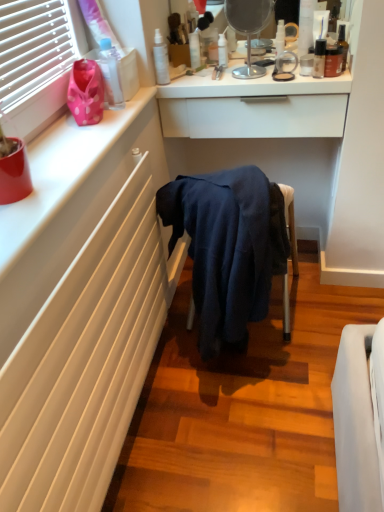
Locate an element on the screen. This screenshot has width=384, height=512. vacant position to the left of satin black bottle at upper right, the 3th toiletry from the right is located at coordinates (263, 81).